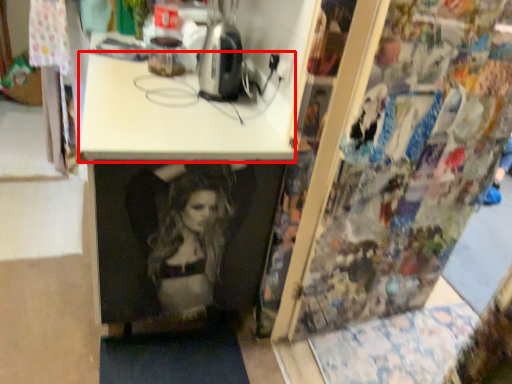
Question: From the image's perspective, considering the relative positions of counter top (annotated by the red box) and appliance in the image provided, where is counter top (annotated by the red box) located with respect to the staircase?

Choices:
 (A) above
 (B) below

Answer: (B)